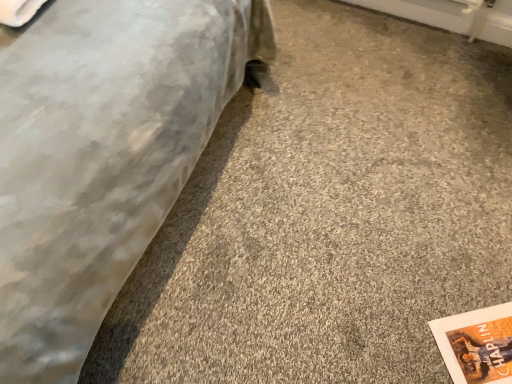
The width and height of the screenshot is (512, 384). I want to click on unoccupied area behind orange paper book at lower right, so click(x=459, y=264).